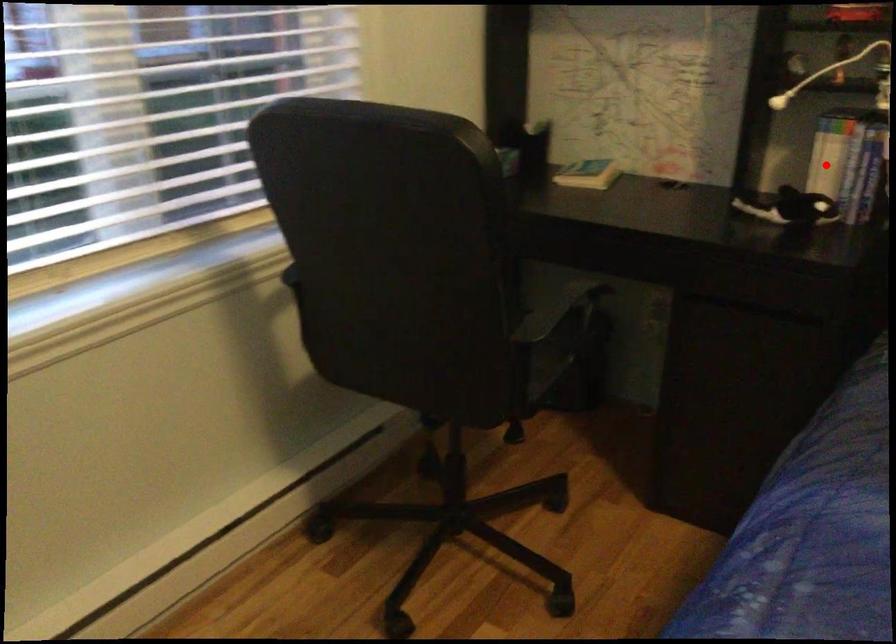
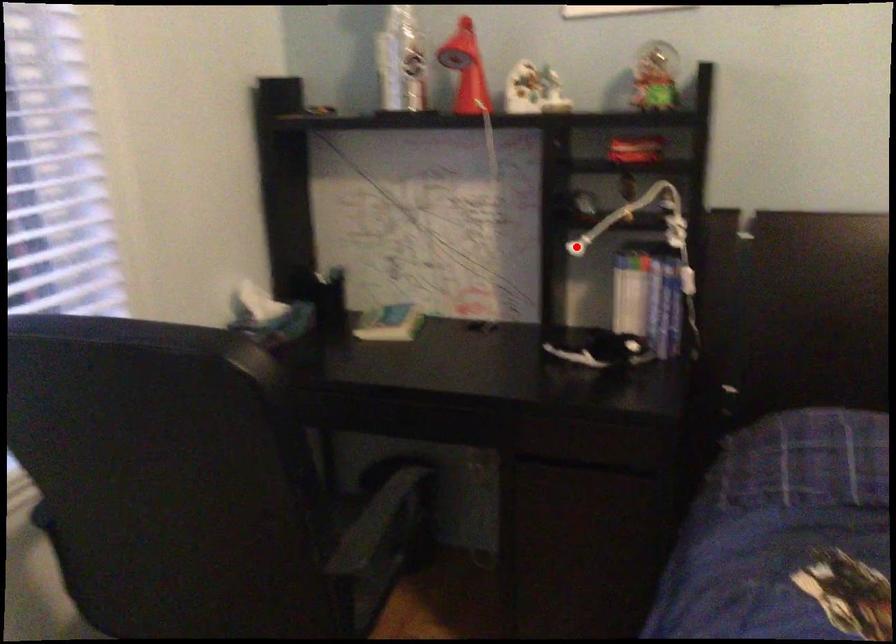
I am providing you with two images of the same scene from different viewpoints. A red point is marked on the first image and another point is marked on the second image. Does the point marked in image1 correspond to the same location as the one in image2?

No